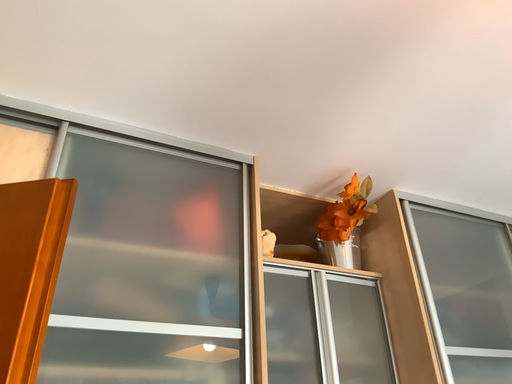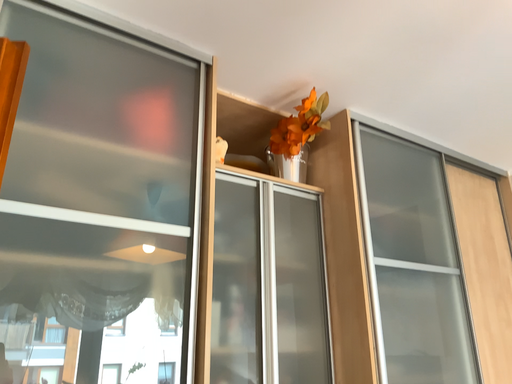
Question: Which way did the camera rotate in the video?

Choices:
 (A) rotated left
 (B) rotated right

Answer: (B)